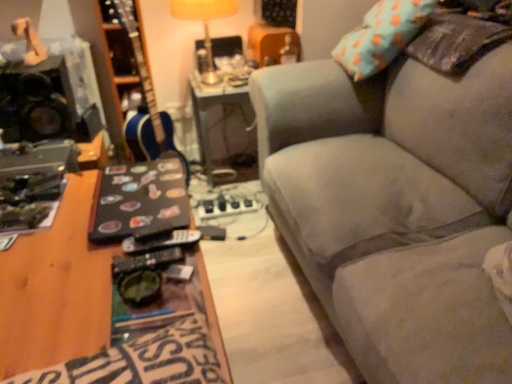
Question: From the image's perspective, is blue glossy guitar at center beneath black matte speaker at left?

Choices:
 (A) yes
 (B) no

Answer: (A)

Question: Can you confirm if blue glossy guitar at center is wider than black matte speaker at left?

Choices:
 (A) yes
 (B) no

Answer: (B)

Question: Does blue glossy guitar at center lie behind black matte speaker at left?

Choices:
 (A) yes
 (B) no

Answer: (B)

Question: Can you confirm if blue glossy guitar at center is positioned to the right of black matte speaker at left?

Choices:
 (A) yes
 (B) no

Answer: (A)

Question: Is blue glossy guitar at center looking in the opposite direction of black matte speaker at left?

Choices:
 (A) yes
 (B) no

Answer: (B)

Question: Are blue glossy guitar at center and black matte speaker at left located far from each other?

Choices:
 (A) yes
 (B) no

Answer: (B)

Question: Is blue glossy guitar at center bigger than yellow fabric lampshade at upper center?

Choices:
 (A) no
 (B) yes

Answer: (B)

Question: Is blue glossy guitar at center positioned behind yellow fabric lampshade at upper center?

Choices:
 (A) yes
 (B) no

Answer: (B)

Question: Is blue glossy guitar at center oriented towards yellow fabric lampshade at upper center?

Choices:
 (A) no
 (B) yes

Answer: (A)

Question: Is blue glossy guitar at center in front of yellow fabric lampshade at upper center?

Choices:
 (A) yes
 (B) no

Answer: (A)

Question: Could yellow fabric lampshade at upper center be considered to be inside blue glossy guitar at center?

Choices:
 (A) yes
 (B) no

Answer: (B)

Question: Is blue glossy guitar at center next to yellow fabric lampshade at upper center and touching it?

Choices:
 (A) no
 (B) yes

Answer: (A)

Question: From a real-world perspective, is black matte speaker at left positioned under metallic silver table at center based on gravity?

Choices:
 (A) yes
 (B) no

Answer: (B)